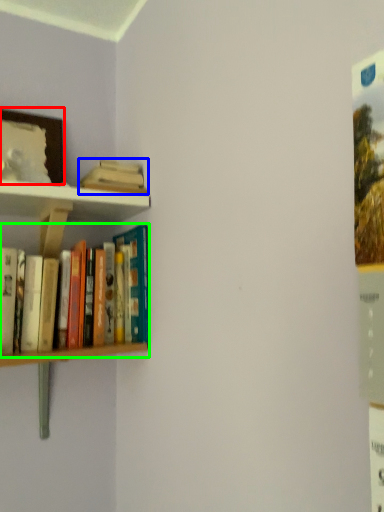
Question: Which object is positioned farthest from picture frame (highlighted by a red box)? Select from book (highlighted by a blue box) and book (highlighted by a green box).

Choices:
 (A) book
 (B) book

Answer: (B)